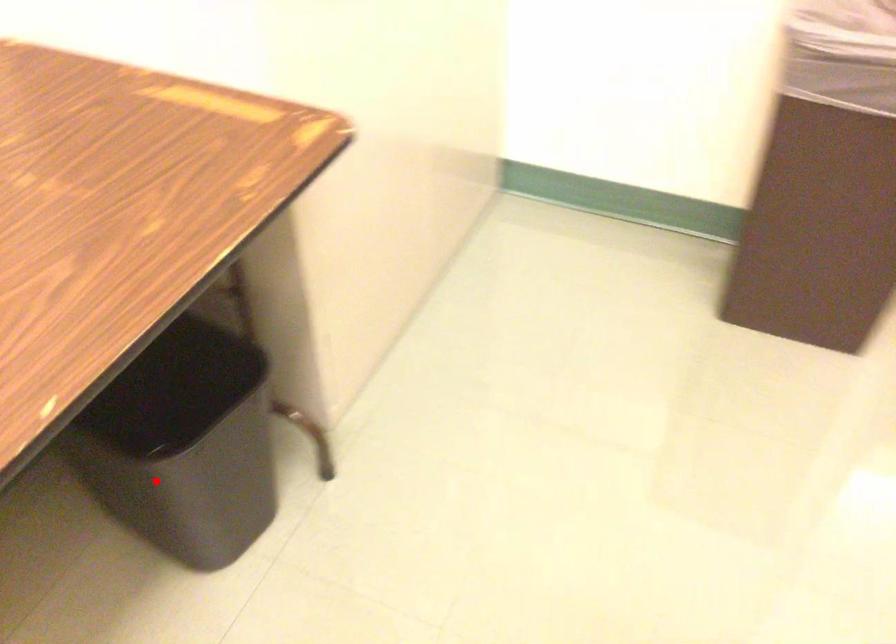
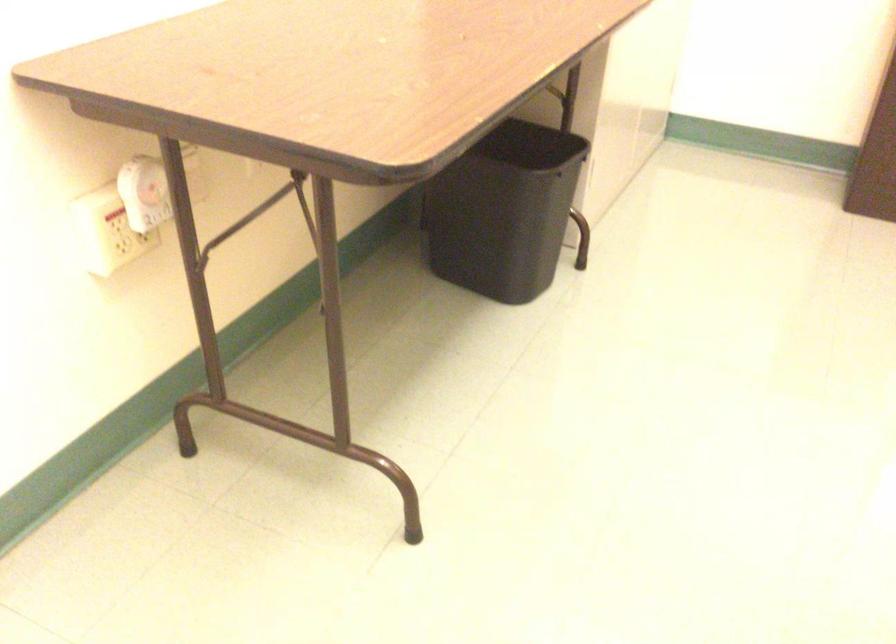
Question: A red point is marked in image1. In image2, is the corresponding 3D point closer to the camera or farther? Reply with the corresponding letter.

Choices:
 (A) The corresponding 3D point is closer.
 (B) The corresponding 3D point is farther.

Answer: (B)